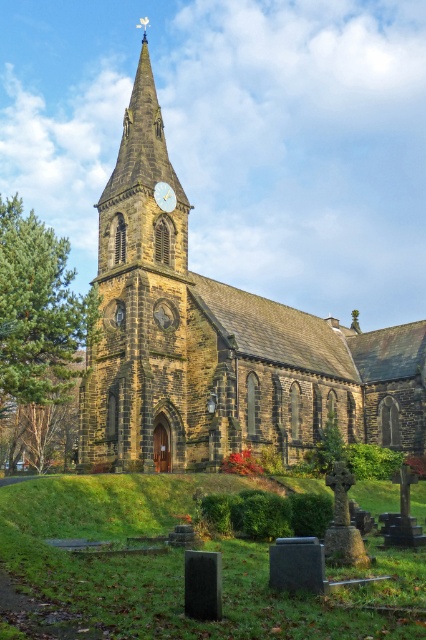
You are an architect planning to build a miniature model of the brown stone church at center and the brown stone clock tower at center. If you want the model to maintain the same proportions as the original, which object should have a wider base in the model?

The brown stone church at center should have a wider base in the model since its width is larger than the brown stone clock tower at center in the original.

You are standing in the graveyard looking at the church. You notice the brown stone clock tower at center and the gold metallic clock at center. Which object is located higher up?

The brown stone clock tower at center is positioned over the gold metallic clock at center, so it is located higher up.

You are standing in the graveyard and want to locate the exact point marked at coordinates point (218, 342). Based on the scene, where would this point be located?

The point (218, 342) is on brown stone church at center.